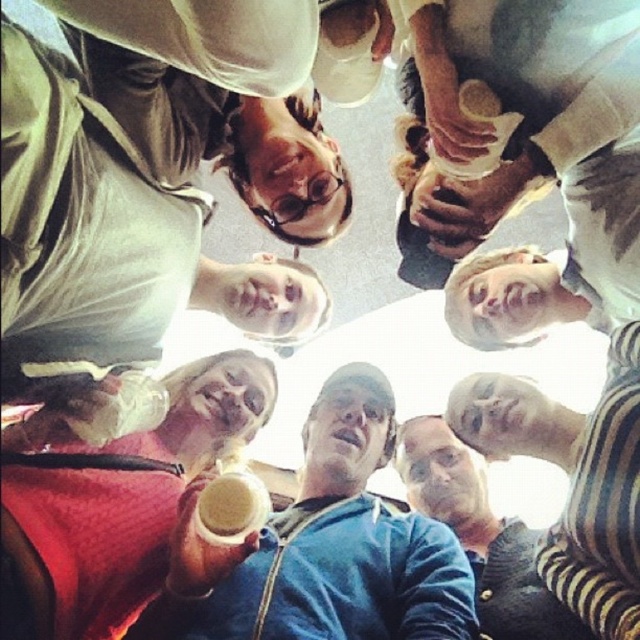
Image resolution: width=640 pixels, height=640 pixels. Describe the element at coordinates (156, 173) in the screenshot. I see `matte white hoodie at upper left` at that location.

Based on the photo, is the position of matte white hoodie at upper left more distant than that of blue denim jacket at center?

No, matte white hoodie at upper left is in front of blue denim jacket at center.

Find the location of a particular element. matte white hoodie at upper left is located at coordinates point(156,173).

Can you confirm if matte white hoodie at upper left is shorter than matte plastic cup at lower left?

No.

Is matte white hoodie at upper left smaller than matte plastic cup at lower left?

Actually, matte white hoodie at upper left might be larger than matte plastic cup at lower left.

Who is more distant from viewer, (16,51) or (38,444)?

The point (38,444) is behind.

Find the location of a particular element. matte white hoodie at upper left is located at coordinates (156, 173).

Find the location of `matte white hoodie at upper left`. matte white hoodie at upper left is located at coordinates (156, 173).

At what (x,y) coordinates should I click in order to perform the action: click on matte white hoodie at upper left. Please return your answer as a coordinate pair (x, y). The image size is (640, 640). Looking at the image, I should click on (156, 173).

I want to click on matte white hoodie at upper left, so click(156, 173).